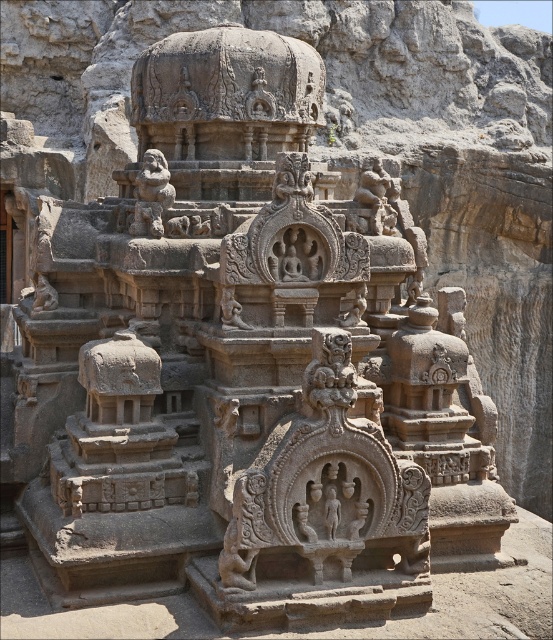
Question: In this image, where is dark gray stone statue at center located relative to rustic stone lion at center?

Choices:
 (A) below
 (B) above

Answer: (A)

Question: Does dark gray stone statue at center have a smaller size compared to rustic stone lion at center?

Choices:
 (A) no
 (B) yes

Answer: (B)

Question: Which point is closer to the camera taking this photo?

Choices:
 (A) (53, 305)
 (B) (226, 317)

Answer: (B)

Question: Can you confirm if dark gray stone statue at center is smaller than rustic stone lion at center?

Choices:
 (A) yes
 (B) no

Answer: (A)

Question: Which point is farther to the camera?

Choices:
 (A) (51, 301)
 (B) (233, 326)

Answer: (A)